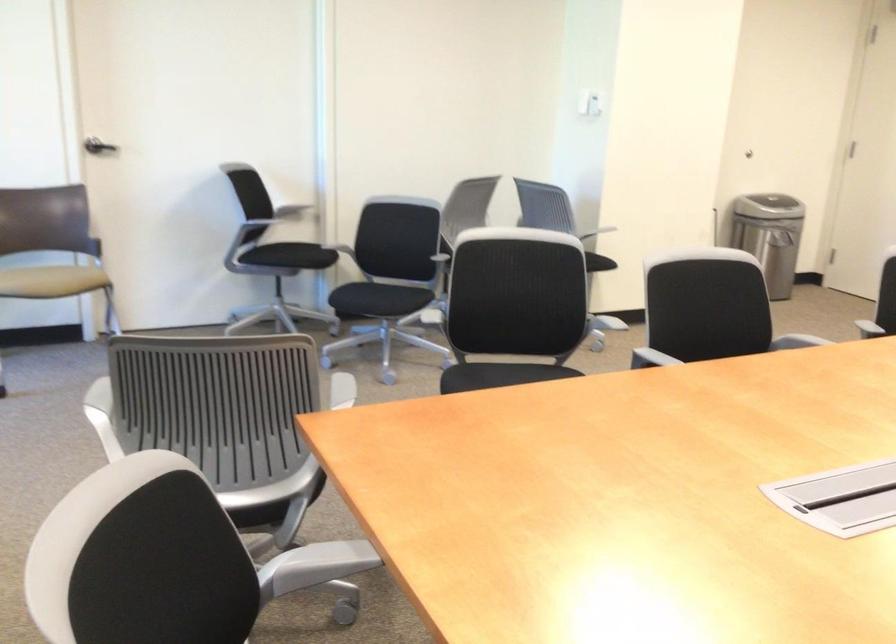
The height and width of the screenshot is (644, 896). What do you see at coordinates (289, 254) in the screenshot?
I see `a beige chair sitting surface` at bounding box center [289, 254].